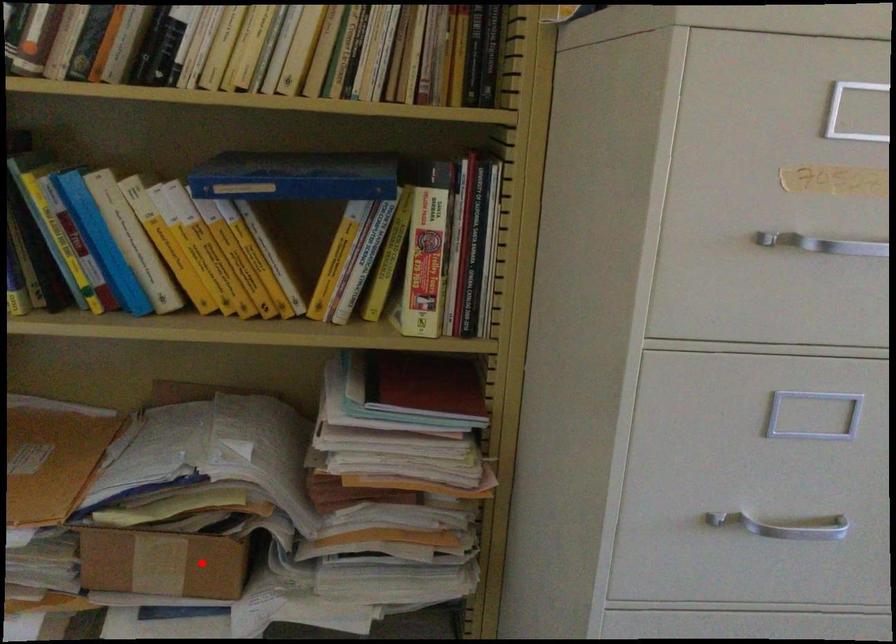
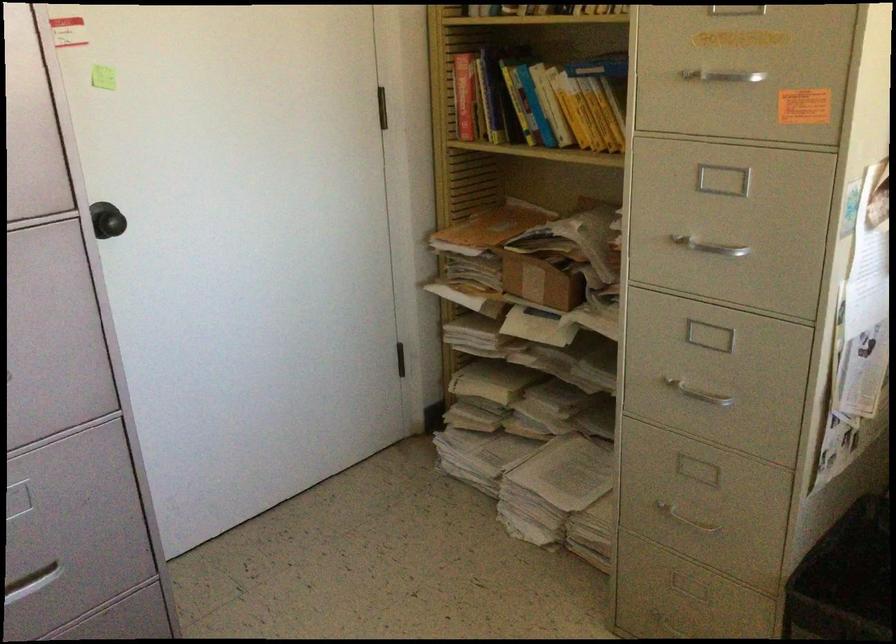
Question: I am providing you with two images of the same scene from different viewpoints. Image1 has a red point marked. In image2, the corresponding 3D location appears at what relative position? Reply with the corresponding letter.

Choices:
 (A) Closer
 (B) Farther

Answer: (B)